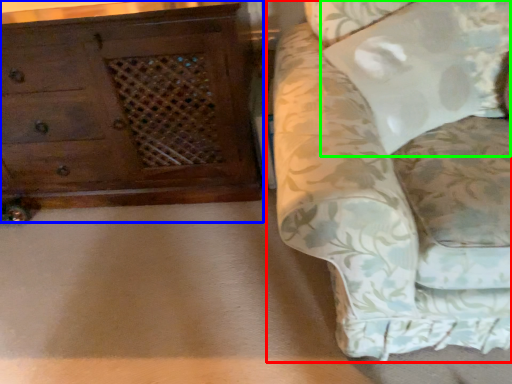
Question: Which object is positioned closest to studio couch (highlighted by a red box)? Select from chest of drawers (highlighted by a blue box) and pillow (highlighted by a green box).

Choices:
 (A) chest of drawers
 (B) pillow

Answer: (B)